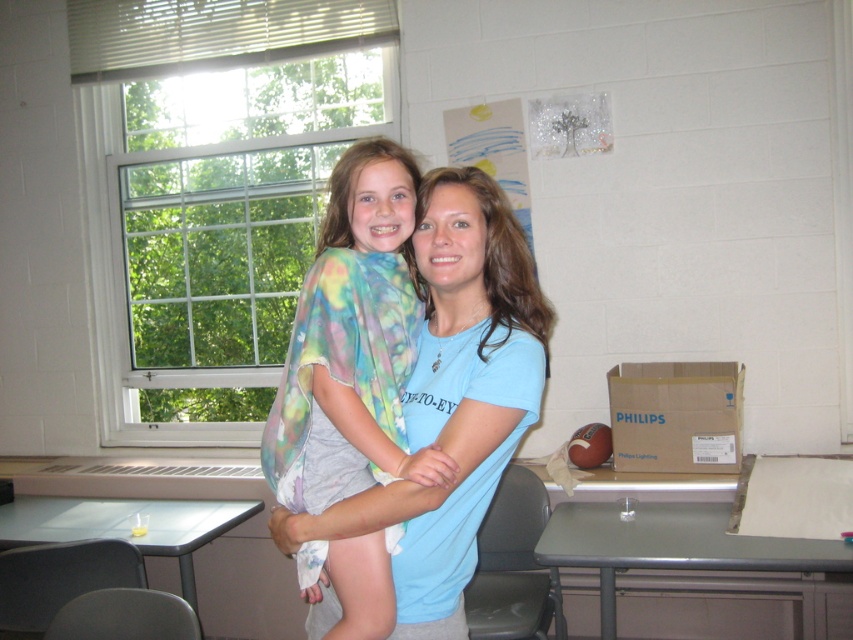
Question: Which is nearer to the tie-dye fabric at center?

Choices:
 (A) gray plastic table at lower left
 (B) metallic gray table at lower right

Answer: (B)

Question: Which of the following is the closest to the observer?

Choices:
 (A) (281, 408)
 (B) (778, 561)

Answer: (A)

Question: Where is tie-dye fabric at center located in relation to metallic gray table at lower right in the image?

Choices:
 (A) left
 (B) right

Answer: (A)

Question: Is metallic gray table at lower right to the left of gray plastic table at lower left from the viewer's perspective?

Choices:
 (A) no
 (B) yes

Answer: (A)

Question: Which object is closer to the camera taking this photo?

Choices:
 (A) metallic gray table at lower right
 (B) gray plastic table at lower left

Answer: (A)

Question: From the image, what is the correct spatial relationship of tie-dye fabric at center in relation to metallic gray table at lower right?

Choices:
 (A) above
 (B) below

Answer: (A)